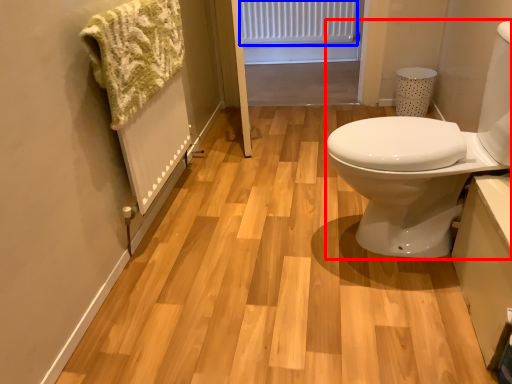
Question: Which object is further to the camera taking this photo, sink (highlighted by a red box) or radiator (highlighted by a blue box)?

Choices:
 (A) sink
 (B) radiator

Answer: (B)